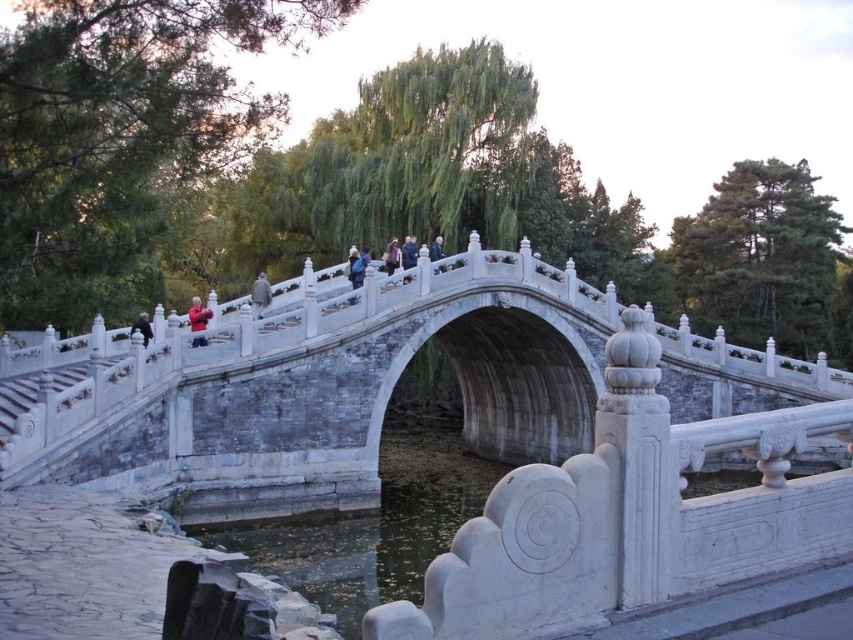
Question: Which object is the farthest from the dark gray stone person at center?

Choices:
 (A) white stone bridge at center
 (B) dark blue fabric jacket at center
 (C) blue fabric jacket at center
 (D) matte gray stone person at center

Answer: (A)

Question: Can you confirm if blue fabric jacket at center is positioned below dark gray stone person at center?

Choices:
 (A) no
 (B) yes

Answer: (A)

Question: Is gray stone statue at center to the left of dark purple fabric bag at center from the viewer's perspective?

Choices:
 (A) no
 (B) yes

Answer: (B)

Question: Does clear water at bridge center have a larger size compared to gray stone statue at center?

Choices:
 (A) yes
 (B) no

Answer: (A)

Question: Which object appears farthest from the camera in this image?

Choices:
 (A) dark blue fabric jacket at center
 (B) clear water at bridge center

Answer: (A)

Question: Which object is positioned farthest from the gray stone statue at center?

Choices:
 (A) matte gray stone person at center
 (B) red fabric jacket at center
 (C) dark purple fabric bag at center

Answer: (A)